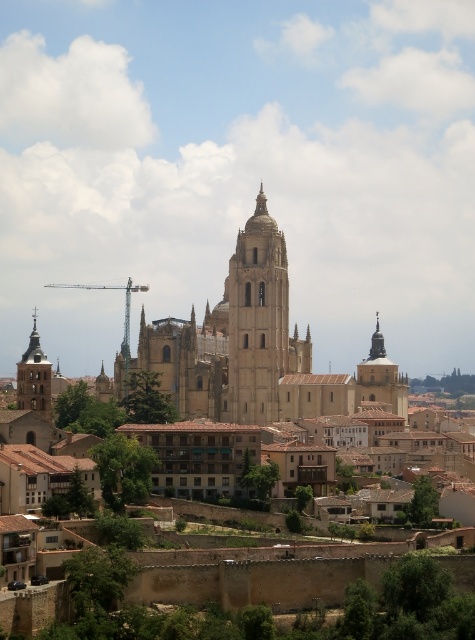
Looking at this image, you are standing in the city square and want to take a photo of both the smooth beige tower at center and the smooth stone tower at center right. Which tower should you move closer to in order to have both towers fully visible in your camera frame?

You should move closer to the smooth beige tower at center because it is closer to you than the smooth stone tower at center right, so adjusting your position near it will help frame both towers better.